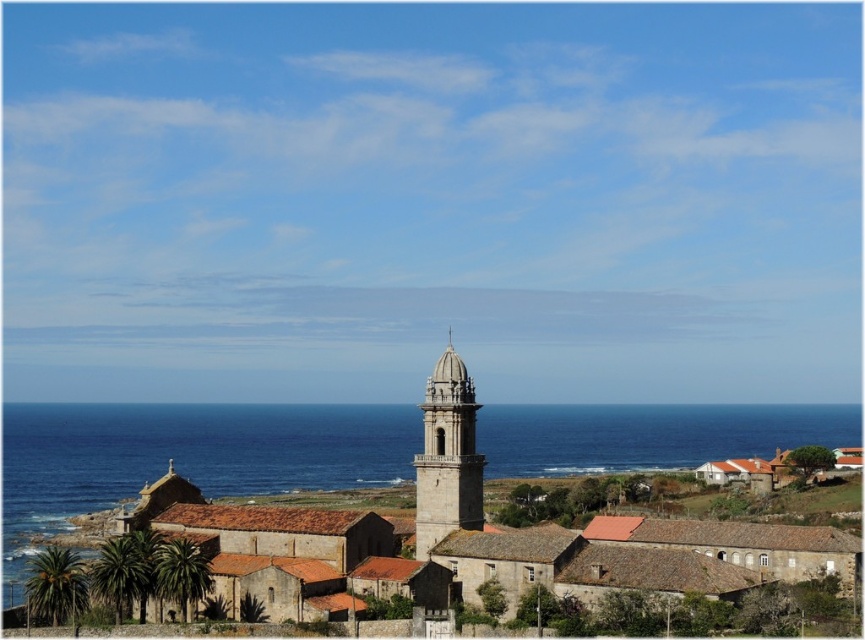
You are a tourist standing on the beach looking at the coastal scene. You notice the blue water at center and the stone steeple at center. Which one appears taller in the image?

The blue water at center appears taller than the stone steeple at center in the image.

You are standing in front of the historic stone church and notice the blue water at center and the stone steeple at center. From your perspective, which object is positioned to the right?

The blue water at center is to the right of the stone steeple at center.

You are a photographer planning to capture the entire church and its surroundings in one shot. Given that your camera can only focus on objects within a 100 cm width, can you fit both the blue water at center and the stone steeple at center into your frame?

The blue water at center might be wider than the stone steeple at center, but without exact measurements, it is uncertain if both will fit within the 100 cm width constraint. Consider adjusting your position or using a wider lens for better coverage.